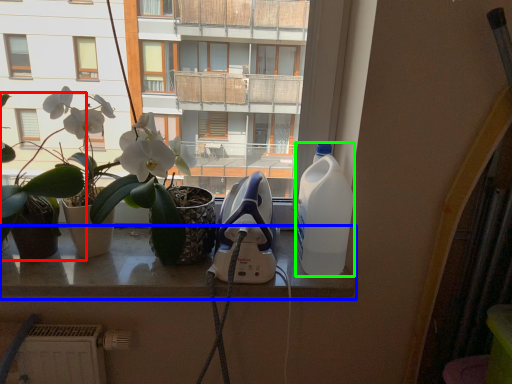
Question: Based on their relative distances, which object is farther from houseplant (highlighted by a red box)? Choose from window (highlighted by a blue box) and bottle (highlighted by a green box).

Choices:
 (A) window
 (B) bottle

Answer: (B)